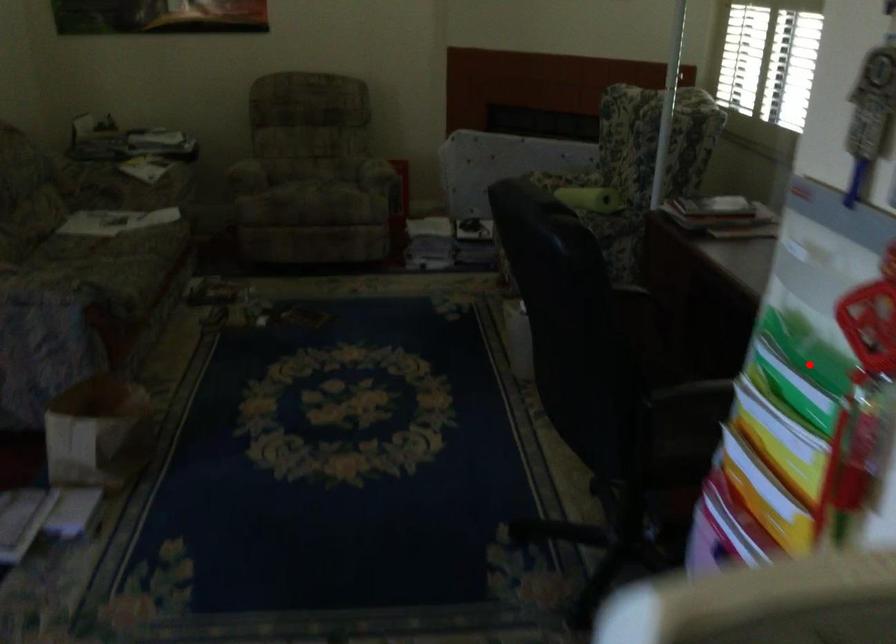
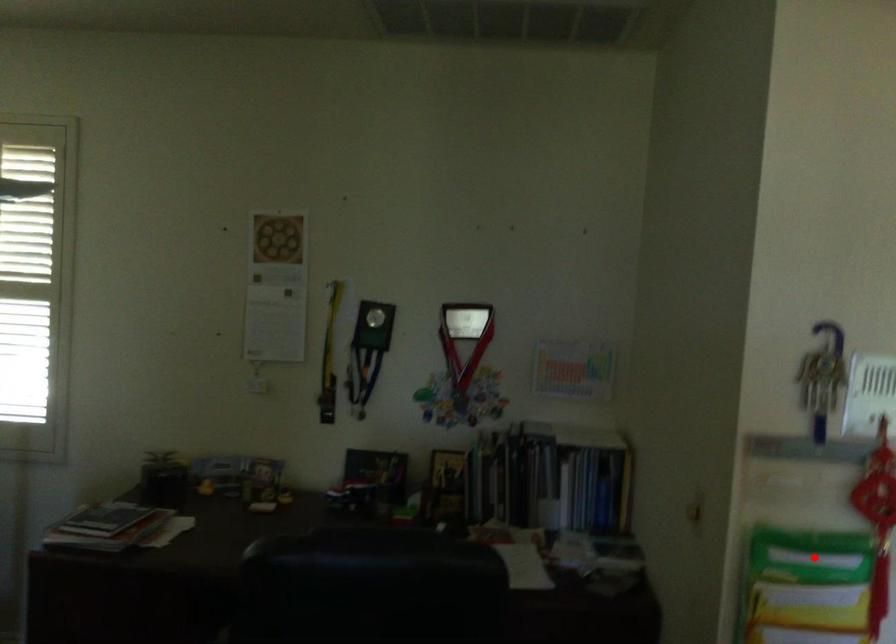
I am providing you with two images of the same scene from different viewpoints. A red point is marked on the first image and another point is marked on the second image. Does the point marked in image1 correspond to the same location as the one in image2?

Yes